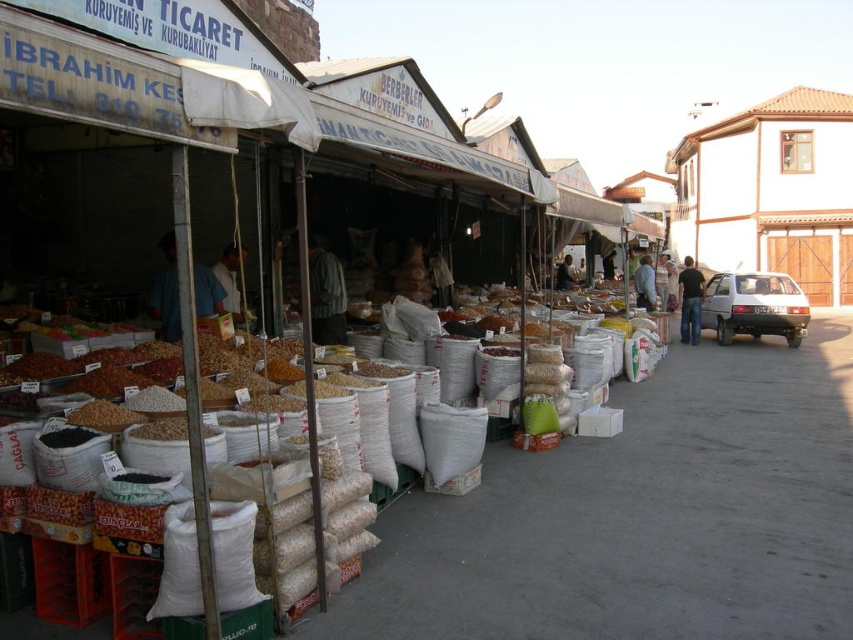
You are a customer at the market and want to buy a shirt. You see both the blue shirt at center and the striped fabric shirt at center. Which one is easier to reach without moving from your current position?

The blue shirt at center is closer to the viewer than the striped fabric shirt at center, so it is easier to reach without moving.

You are a customer at the market and want to buy both the blue shirt at center and the striped fabric shirt at center. However, you have a small bag that can only carry items that take up less space. Which shirt should you choose?

The blue shirt at center occupies less space than the striped fabric shirt at center, so you should choose the blue shirt at center.